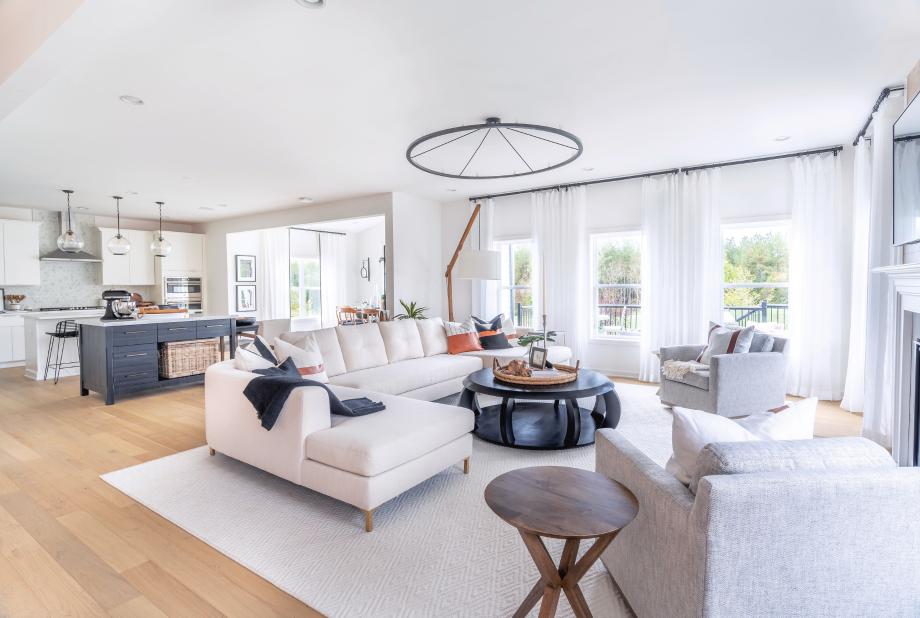
I want to click on glass light, so click(x=71, y=242), click(x=125, y=240), click(x=156, y=246).